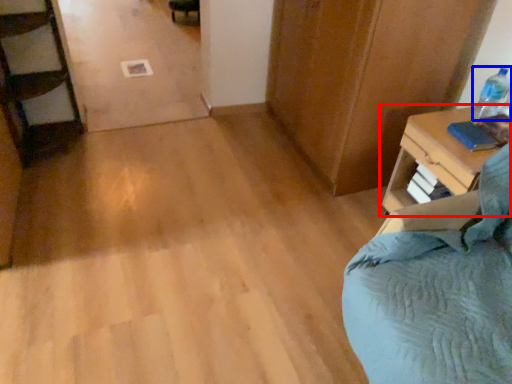
Question: Which of the following is the farthest to the observer, nightstand (highlighted by a red box) or bottle (highlighted by a blue box)?

Choices:
 (A) nightstand
 (B) bottle

Answer: (B)